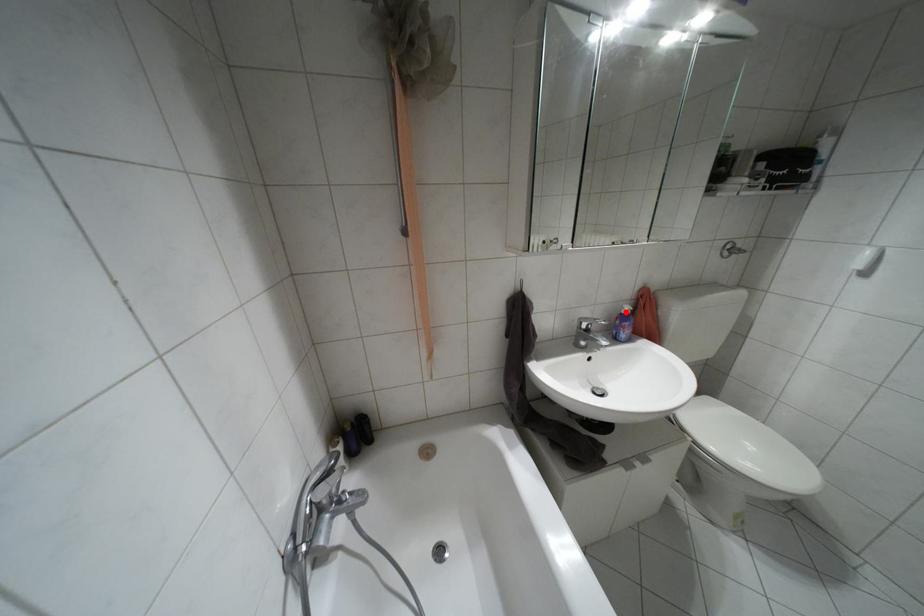
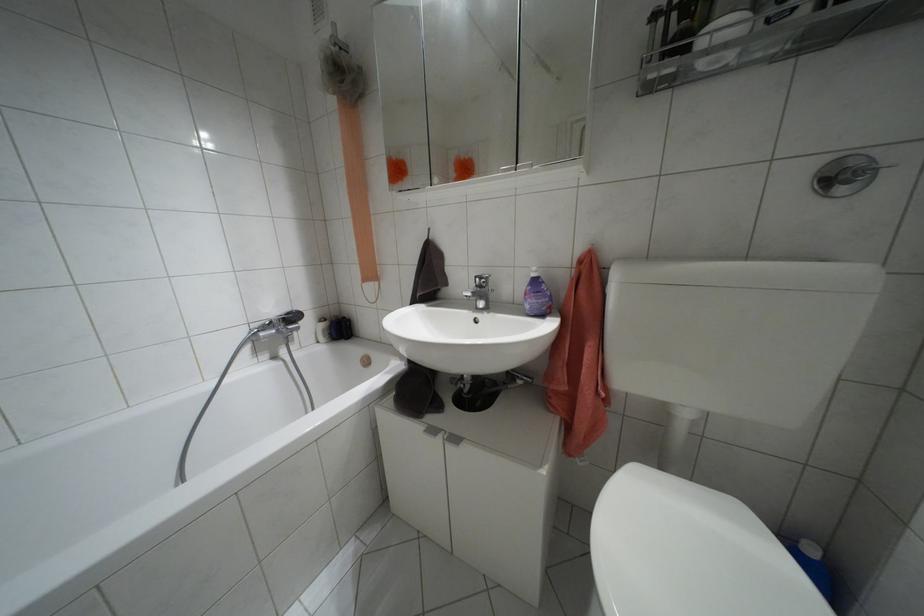
Find the pixel in the second image that matches the highlighted location in the first image.

(532, 274)